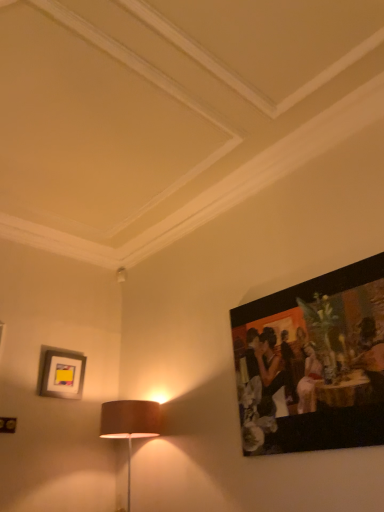
Question: Is matte yellow picture frame at upper left, which is the first picture frame from back to front, surrounding matte black painting at upper right, the 1th picture frame positioned from the right?

Choices:
 (A) no
 (B) yes

Answer: (A)

Question: Is matte black painting at upper right, which ranks as the 1th picture frame in front-to-back order, at the back of matte yellow picture frame at upper left, which is the first picture frame from back to front?

Choices:
 (A) no
 (B) yes

Answer: (A)

Question: Would you say matte yellow picture frame at upper left, marked as the 1th picture frame in a left-to-right arrangement, is outside matte black painting at upper right, positioned as the 2th picture frame in back-to-front order?

Choices:
 (A) yes
 (B) no

Answer: (A)

Question: Is matte yellow picture frame at upper left, which is the first picture frame from back to front, facing towards matte black painting at upper right, positioned as the 2th picture frame in back-to-front order?

Choices:
 (A) no
 (B) yes

Answer: (B)

Question: Can you confirm if matte yellow picture frame at upper left, marked as the 1th picture frame in a left-to-right arrangement, is thinner than matte black painting at upper right, the second picture frame when ordered from left to right?

Choices:
 (A) yes
 (B) no

Answer: (B)

Question: From the image's perspective, is matte yellow picture frame at upper left, positioned as the 2th picture frame in right-to-left order, below matte black painting at upper right, the 1th picture frame positioned from the right?

Choices:
 (A) yes
 (B) no

Answer: (A)

Question: Can we say matte black painting at upper right, positioned as the 2th picture frame in back-to-front order, lies outside matte yellow picture frame at upper left, marked as the 1th picture frame in a left-to-right arrangement?

Choices:
 (A) no
 (B) yes

Answer: (B)

Question: Are matte black painting at upper right, the 1th picture frame positioned from the right, and matte yellow picture frame at upper left, placed as the second picture frame when sorted from front to back, far apart?

Choices:
 (A) no
 (B) yes

Answer: (B)

Question: Are matte black painting at upper right, which ranks as the 1th picture frame in front-to-back order, and matte yellow picture frame at upper left, which is the first picture frame from back to front, making contact?

Choices:
 (A) yes
 (B) no

Answer: (B)

Question: Is matte black painting at upper right, which ranks as the 1th picture frame in front-to-back order, to the left of matte yellow picture frame at upper left, positioned as the 2th picture frame in right-to-left order, from the viewer's perspective?

Choices:
 (A) yes
 (B) no

Answer: (B)

Question: Does matte black painting at upper right, the second picture frame when ordered from left to right, have a greater height compared to matte yellow picture frame at upper left, which is the first picture frame from back to front?

Choices:
 (A) no
 (B) yes

Answer: (B)

Question: Would you say matte yellow picture frame at upper left, positioned as the 2th picture frame in right-to-left order, is part of matte black painting at upper right, the second picture frame when ordered from left to right,'s contents?

Choices:
 (A) no
 (B) yes

Answer: (A)

Question: From their relative heights in the image, would you say matte yellow picture frame at upper left, which is the first picture frame from back to front, is taller or shorter than matte black painting at upper right, positioned as the 2th picture frame in back-to-front order?

Choices:
 (A) tall
 (B) short

Answer: (B)